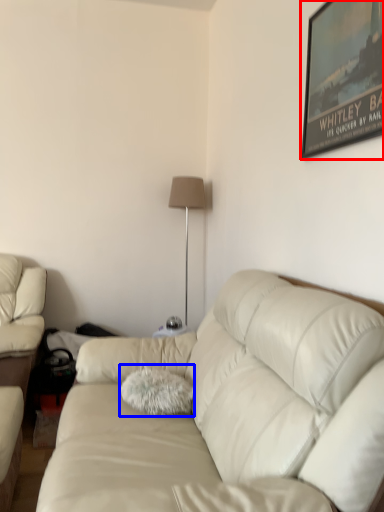
Question: Which object is closer to the camera taking this photo, picture frame (highlighted by a red box) or throw pillow (highlighted by a blue box)?

Choices:
 (A) picture frame
 (B) throw pillow

Answer: (A)